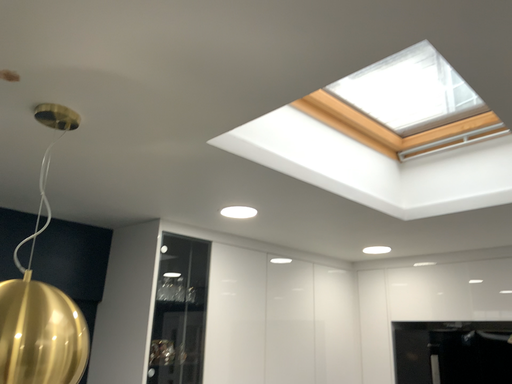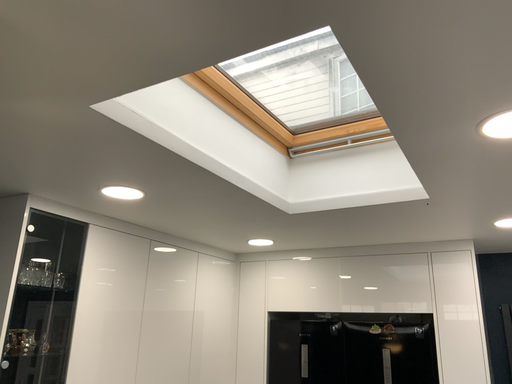
Question: How did the camera likely rotate when shooting the video?

Choices:
 (A) rotated left
 (B) rotated right

Answer: (B)